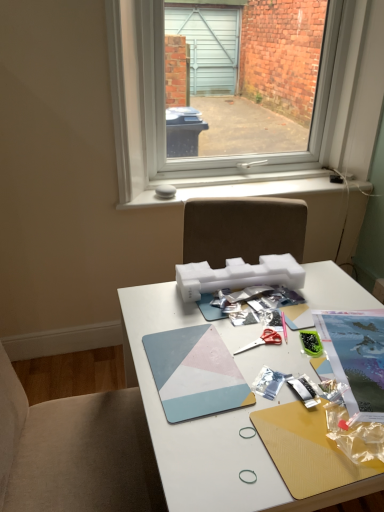
Question: From a real-world perspective, relative to transparent glass window at upper center, is geometric matte mousepad at center, positioned as the first magazine in left-to-right order, vertically above or below?

Choices:
 (A) below
 (B) above

Answer: (A)

Question: Is point (x=241, y=403) closer or farther from the camera than point (x=158, y=69)?

Choices:
 (A) closer
 (B) farther

Answer: (A)

Question: Based on their relative distances, which object is nearer to the green plastic container at center-right?

Choices:
 (A) transparent glass window at upper center
 (B) white matte desk at center
 (C) geometric matte mousepad at center, positioned as the first magazine in left-to-right order
 (D) printed paper magazine at center right, the second magazine when ordered from left to right
 (E) red plastic scissors at center

Answer: (E)

Question: Which is farther from the red plastic scissors at center?

Choices:
 (A) white matte desk at center
 (B) transparent glass window at upper center
 (C) green plastic container at center-right
 (D) printed paper magazine at center right, the second magazine when ordered from left to right
 (E) geometric matte mousepad at center, acting as the 2th magazine starting from the right

Answer: (B)